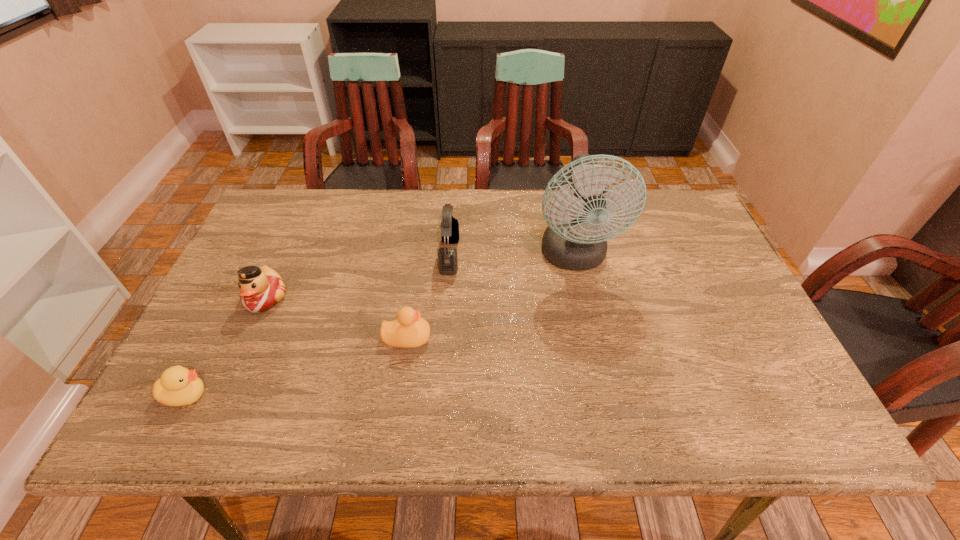
The image size is (960, 540). I want to click on free space between the second tallest object and the farthest duck, so click(358, 277).

Identify the location of vacant point located between the second tallest object and the tallest object. The width and height of the screenshot is (960, 540). (513, 256).

Identify the location of object that can be found as the fourth closest to the tallest object. (178, 386).

Identify the location of the third closest object to the second object from right to left. 262,288.

Select which duck is the second closest to the fan. Please provide its 2D coordinates. Your answer should be formatted as a tuple, i.e. [(x, y)], where the tuple contains the x and y coordinates of a point satisfying the conditions above.

[(262, 288)]

Where is `duck that is the closest to the nearest duck`? This screenshot has width=960, height=540. duck that is the closest to the nearest duck is located at coordinates [262, 288].

Identify the location of vacant point that satisfies the following two spatial constraints: 1. in front of the fan where the airflow is directed; 2. on the face of the second nearest object. Image resolution: width=960 pixels, height=540 pixels. (592, 338).

Where is `vacant point that satisfies the following two spatial constraints: 1. in front of the tallest object where the airflow is directed; 2. on the face of the fourth farthest object`? The width and height of the screenshot is (960, 540). vacant point that satisfies the following two spatial constraints: 1. in front of the tallest object where the airflow is directed; 2. on the face of the fourth farthest object is located at coordinates (592, 338).

At what (x,y) coordinates should I click in order to perform the action: click on free location that satisfies the following two spatial constraints: 1. on the face of the farthest duck; 2. at the beak of the nearest duck. Please return your answer as a coordinate pair (x, y). Looking at the image, I should click on (223, 395).

You are a GUI agent. You are given a task and a screenshot of the screen. Output one action in this format:
    pyautogui.click(x=<x>, y=<y>)
    Task: Click on the free space in the image that satisfies the following two spatial constraints: 1. on the headband of the headset; 2. on the face of the farthest duck
    This screenshot has width=960, height=540.
    Given the screenshot: What is the action you would take?
    pyautogui.click(x=446, y=299)